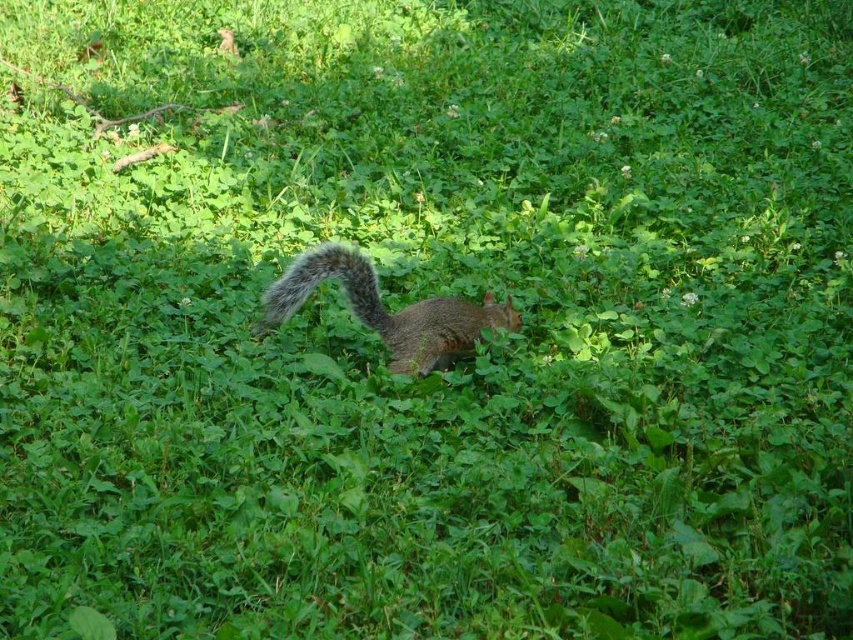
You are a photographer trying to capture the gray squirrel in the center of the image. The camera you are using has a focus point at coordinate point (x=386, y=310). Will the squirrel be in focus?

The gray squirrel at center is located at point (x=386, y=310), so the focus point is exactly where the squirrel is, so yes, the squirrel will be in focus.